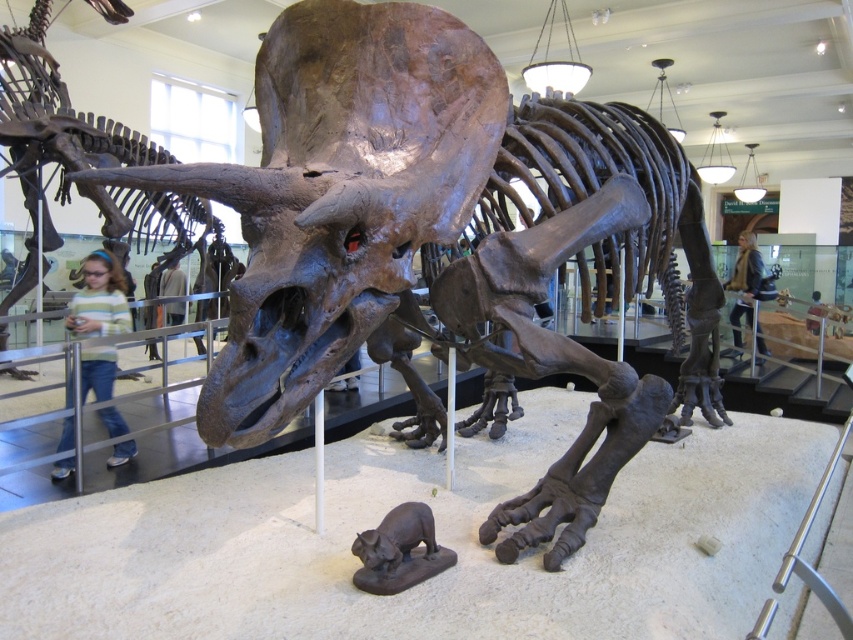
You are a museum visitor who wants to take a photo of both the rusty metallic dinosaur at center and the shiny black statue at lower center. Since you have a limited zoom range, you need to know which one is taller. Can you tell me which is taller?

The rusty metallic dinosaur at center is taller than the shiny black statue at lower center according to the description.

You are a museum visitor standing in front of the Triceratops skeleton. You notice two points marked on the skeleton. One is at coordinate point (45,122) and the other is at point (403,528). Which point is closer to you?

Point (45,122) is closer to you because it is further to the viewer than point (403,528).

You are a visitor at the museum and want to take a photo of both the rusty metallic dinosaur at center and the shiny black statue at lower center. Which object should you focus on first if you want to capture both in the same frame without moving your camera?

The rusty metallic dinosaur at center is to the left of the shiny black statue at lower center. Since they are positioned side by side horizontally, you can focus on one and ensure the other is within the frame by centering your shot between them.